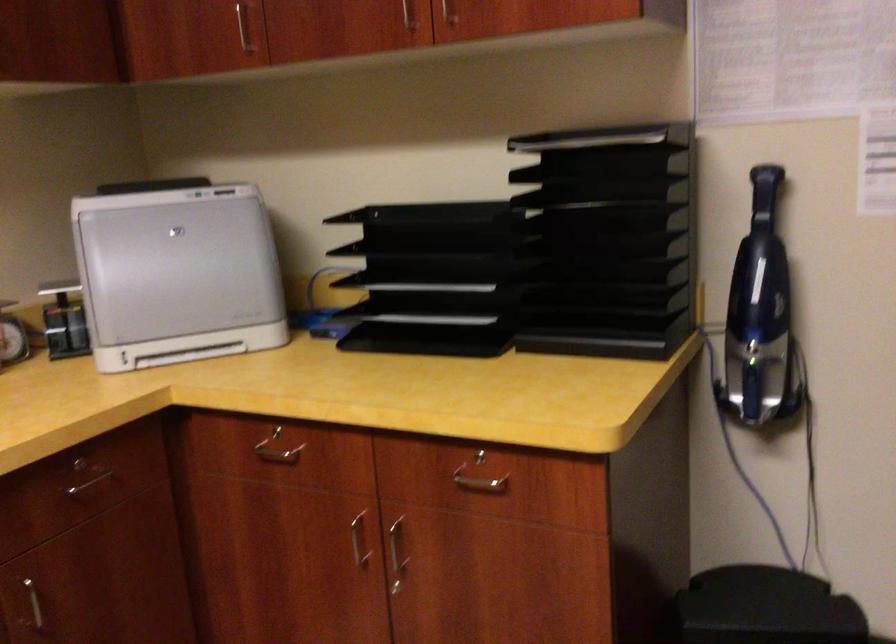
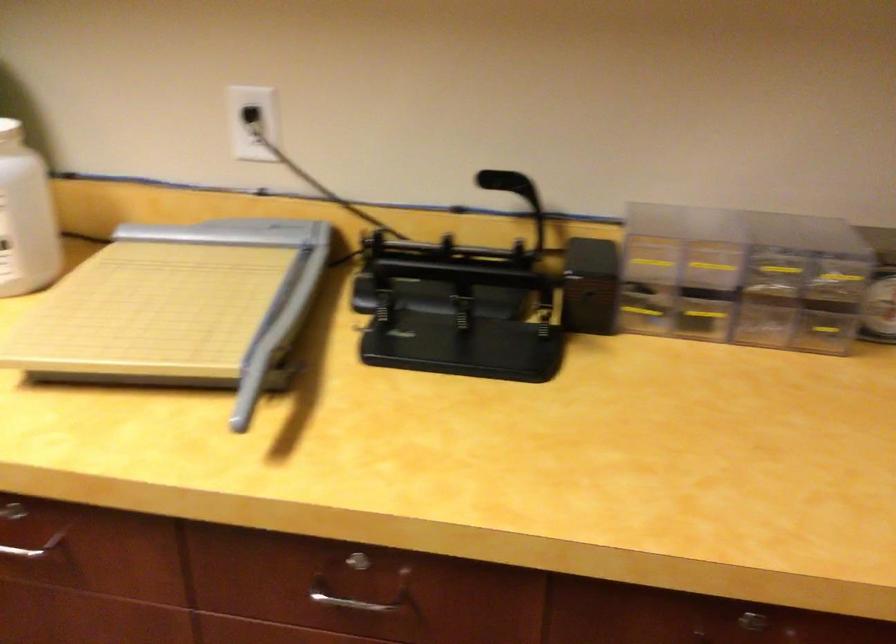
Where in the second image is the point corresponding to pixel 90 458 from the first image?

(748, 623)